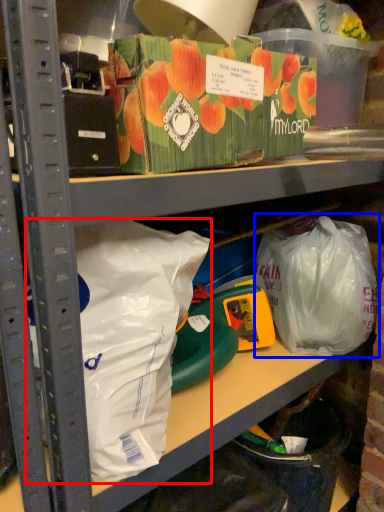
Question: Among these objects, which one is farthest to the camera, plastic bag (highlighted by a red box) or plastic bag (highlighted by a blue box)?

Choices:
 (A) plastic bag
 (B) plastic bag

Answer: (B)